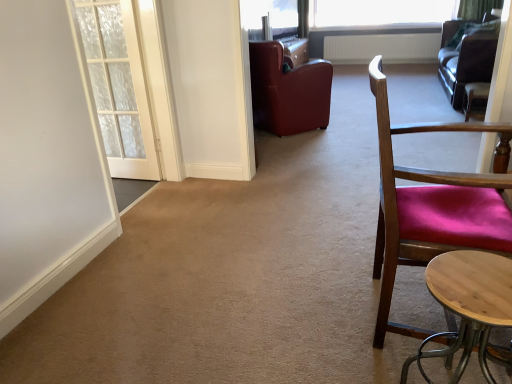
Question: Can you confirm if white textured radiator at upper center is positioned to the right of white sheer curtain at upper right?

Choices:
 (A) yes
 (B) no

Answer: (B)

Question: Is white textured radiator at upper center smaller than white sheer curtain at upper right?

Choices:
 (A) yes
 (B) no

Answer: (B)

Question: Can you confirm if white textured radiator at upper center is wider than white sheer curtain at upper right?

Choices:
 (A) yes
 (B) no

Answer: (B)

Question: From a real-world perspective, is white textured radiator at upper center located beneath white sheer curtain at upper right?

Choices:
 (A) no
 (B) yes

Answer: (B)

Question: From the image's perspective, is white textured radiator at upper center below white sheer curtain at upper right?

Choices:
 (A) no
 (B) yes

Answer: (B)

Question: Considering the positions of light wood round table at lower right and transparent glass window screen at upper center in the image, is light wood round table at lower right bigger or smaller than transparent glass window screen at upper center?

Choices:
 (A) small
 (B) big

Answer: (A)

Question: Is light wood round table at lower right inside or outside of transparent glass window screen at upper center?

Choices:
 (A) inside
 (B) outside

Answer: (B)

Question: In terms of height, does light wood round table at lower right look taller or shorter compared to transparent glass window screen at upper center?

Choices:
 (A) tall
 (B) short

Answer: (B)

Question: From the image's perspective, is light wood round table at lower right located above or below transparent glass window screen at upper center?

Choices:
 (A) above
 (B) below

Answer: (B)

Question: Is point (481, 243) positioned closer to the camera than point (151, 125)?

Choices:
 (A) closer
 (B) farther

Answer: (A)

Question: Considering the positions of wooden chair with red cushion at right, which appears as the 2th chair when viewed from the left, and white textured door at left in the image, is wooden chair with red cushion at right, which appears as the 2th chair when viewed from the left, wider or thinner than white textured door at left?

Choices:
 (A) wide
 (B) thin

Answer: (A)

Question: Considering their positions, is wooden chair with red cushion at right, the third chair in the back-to-front sequence, located in front of or behind white textured door at left?

Choices:
 (A) front
 (B) behind

Answer: (A)

Question: Is wooden chair with red cushion at right, which is counted as the first chair, starting from the front, bigger or smaller than white textured door at left?

Choices:
 (A) big
 (B) small

Answer: (A)

Question: Is point (331, 67) positioned closer to the camera than point (476, 94)?

Choices:
 (A) closer
 (B) farther

Answer: (A)

Question: Is leather at center, which is the first chair in left-to-right order, wider or thinner than velvet burgundy chair at right, arranged as the third chair when viewed from the left?

Choices:
 (A) wide
 (B) thin

Answer: (A)